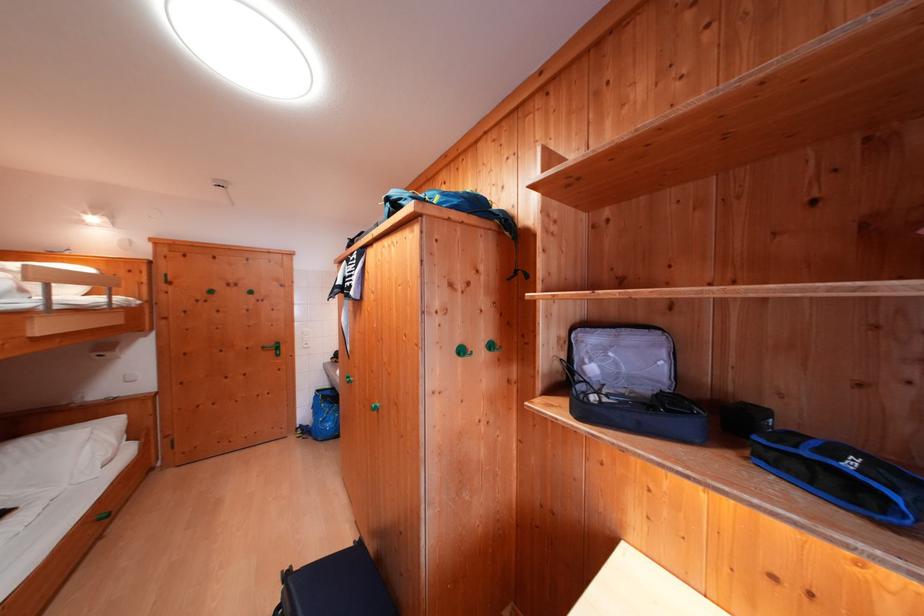
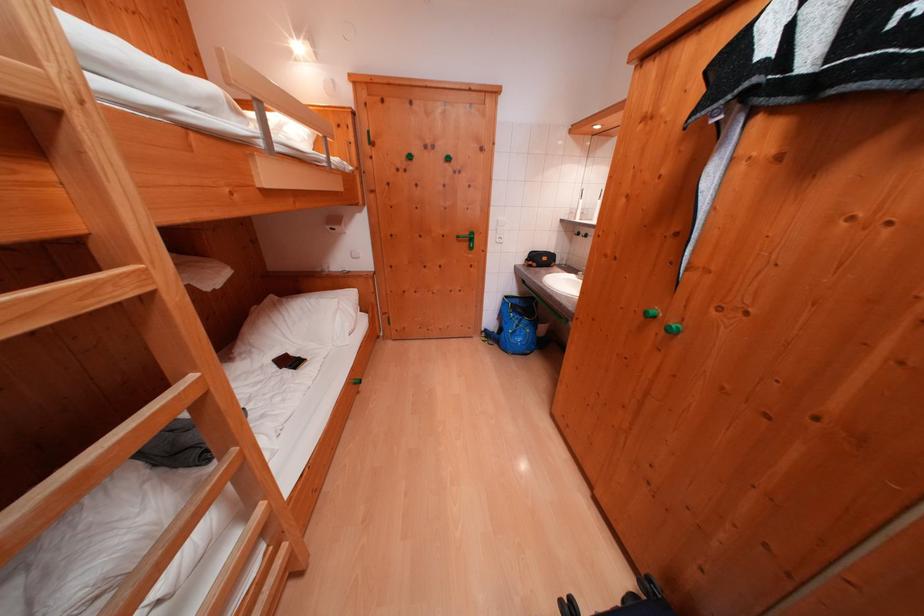
Find the pixel in the second image that matches pixel 271 352 in the first image.

(466, 241)